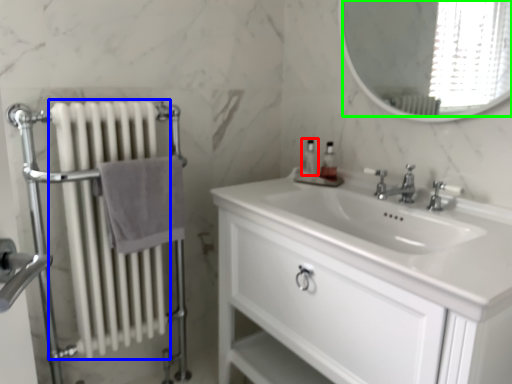
Question: Based on their relative distances, which object is farther from soap dispenser (highlighted by a red box)? Choose from radiator (highlighted by a blue box) and mirror (highlighted by a green box).

Choices:
 (A) radiator
 (B) mirror

Answer: (B)